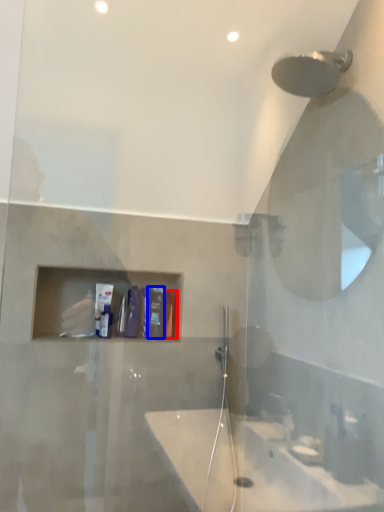
Question: Which object appears closest to the camera in this image, toiletry (highlighted by a red box) or toiletry (highlighted by a blue box)?

Choices:
 (A) toiletry
 (B) toiletry

Answer: (B)